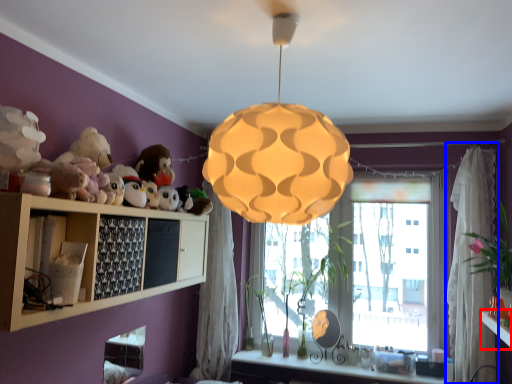
Question: Which point is closer to the camera, table (highlighted by a red box) or curtain (highlighted by a blue box)?

Choices:
 (A) table
 (B) curtain

Answer: (A)